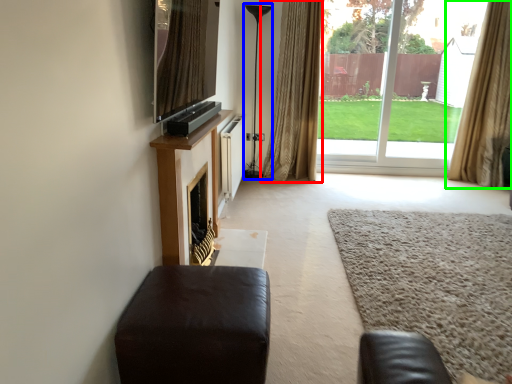
Question: Which is farther away from curtain (highlighted by a red box)? lamp (highlighted by a blue box) or curtain (highlighted by a green box)?

Choices:
 (A) lamp
 (B) curtain

Answer: (B)